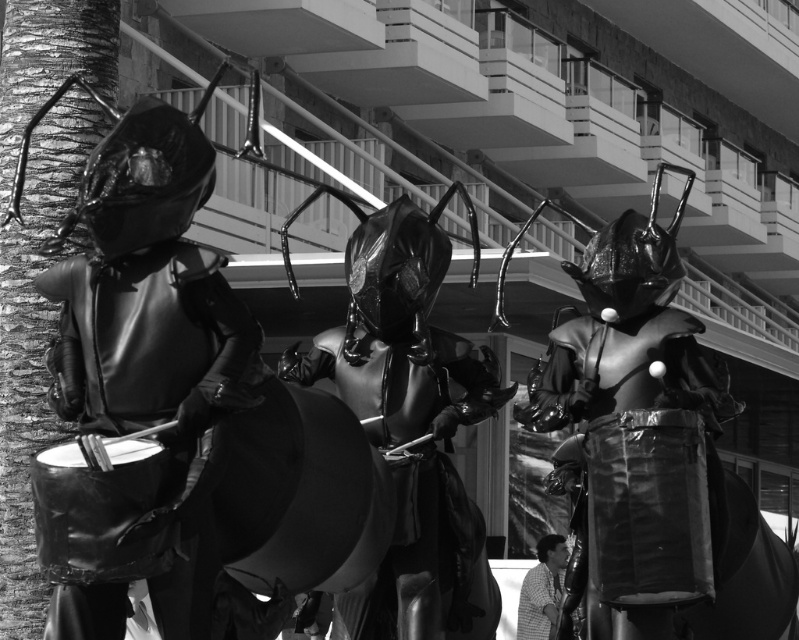
Does glossy metallic ant at center have a larger size compared to glossy black drum at center?

No.

Who is more distant from viewer, (662,442) or (471,605)?

Point (471,605)

Identify the location of glossy metallic ant at center. Image resolution: width=799 pixels, height=640 pixels. (635, 433).

This screenshot has height=640, width=799. Find the location of `glossy metallic ant at center`. glossy metallic ant at center is located at coordinates (635, 433).

Is glossy black drum at center taller than matte black costume at lower right?

Correct, glossy black drum at center is much taller as matte black costume at lower right.

I want to click on glossy black drum at center, so click(414, 465).

Does glossy metallic ant at center lie behind matte black costume at lower right?

That is False.

Who is more distant from viewer, (579,396) or (557,602)?

The point (557,602) is behind.

You are a GUI agent. You are given a task and a screenshot of the screen. Output one action in this format:
    pyautogui.click(x=<x>, y=<y>)
    Task: Click on the glossy metallic ant at center
    The width and height of the screenshot is (799, 640).
    Given the screenshot: What is the action you would take?
    pyautogui.click(x=635, y=433)